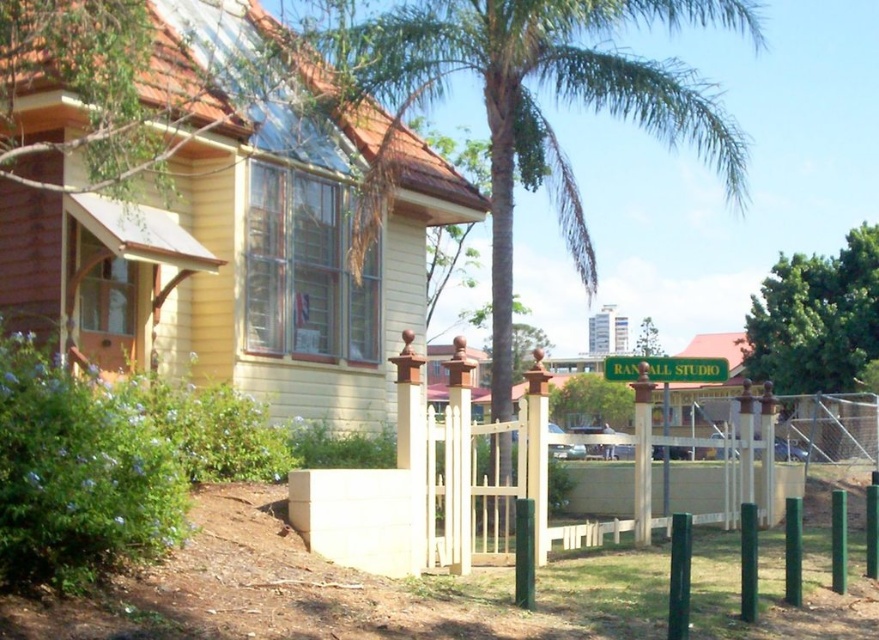
Question: Can you confirm if green leafy palm tree at center is wider than green leafy tree at right?

Choices:
 (A) yes
 (B) no

Answer: (A)

Question: Does green leafy palm tree at center appear over green leafy tree at right?

Choices:
 (A) yes
 (B) no

Answer: (A)

Question: Which point appears closest to the camera in this image?

Choices:
 (A) (683, 20)
 (B) (826, 355)

Answer: (B)

Question: Can you confirm if green leafy palm tree at center is smaller than green leafy tree at right?

Choices:
 (A) yes
 (B) no

Answer: (B)

Question: Which point is closer to the camera taking this photo?

Choices:
 (A) (854, 356)
 (B) (527, 180)

Answer: (B)